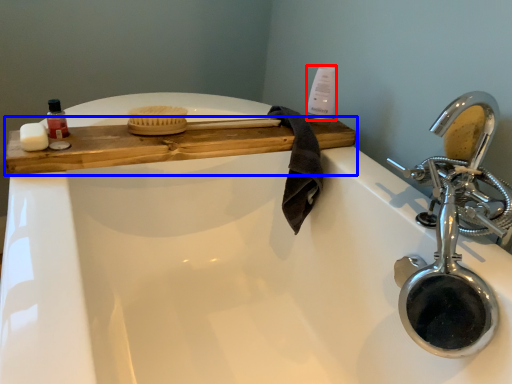
Question: Which object appears farthest to the camera in this image, cleaning product (highlighted by a red box) or counter (highlighted by a blue box)?

Choices:
 (A) cleaning product
 (B) counter

Answer: (A)